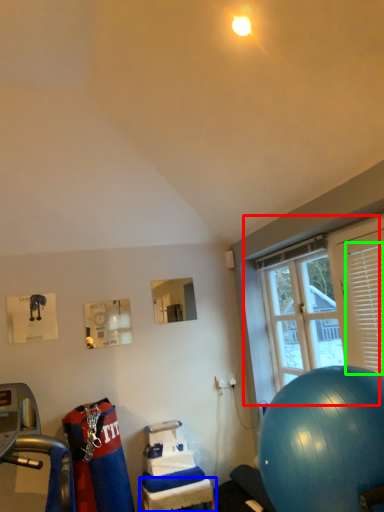
Question: Considering the real-world distances, which object is farthest from window (highlighted by a red box)? table (highlighted by a blue box) or shutter (highlighted by a green box)?

Choices:
 (A) table
 (B) shutter

Answer: (A)